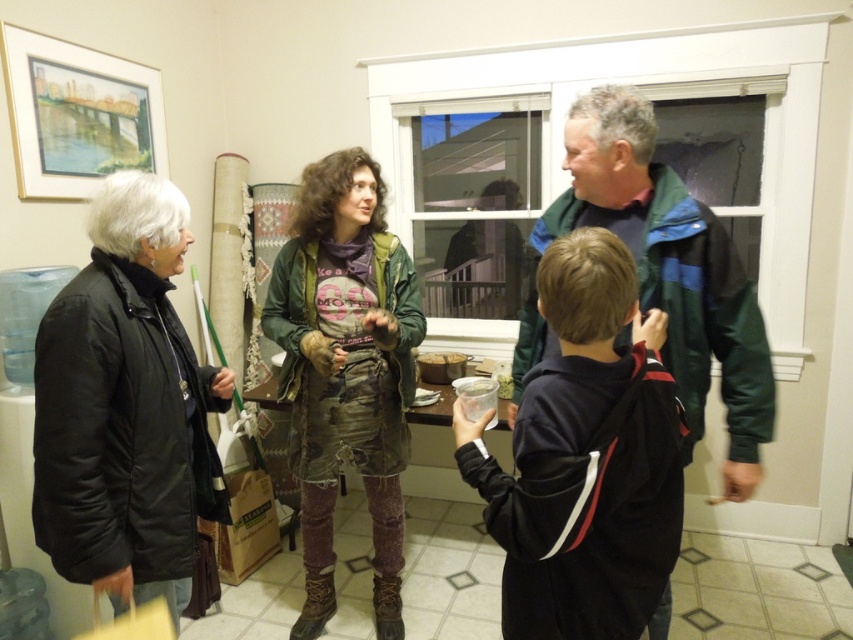
You are a photographer trying to capture a group photo of the dark blue fleece jacket at center and the rusty leather jacket at center. The camera you are using has a minimum focus distance of 36 inches. Will both jackets be in focus if you position the camera exactly in between them?

The dark blue fleece jacket at center and the rusty leather jacket at center are 36.89 inches apart. If the camera is placed exactly between them, each jacket will be 18.445 inches away from the camera. Since the minimum focus distance is 36 inches, which is greater than 18.445 inches, the jackets will not be in focus. The camera needs to be moved closer to ensure both are within the focus range.

You are trying to decide which jacket to borrow for a quick errand. The black puffy jacket at left is narrower than the green jacket at center. Which jacket would be easier to move through a narrow hallway?

The black puffy jacket at left has a lesser width compared to the green jacket at center, so it would be easier to move through a narrow hallway because it is narrower.

You are standing at the origin of the coordinate system in the room. There are two points marked in the room at coordinates point (538, 275) and point (370, 422). Which point is closer to you?

Point (538, 275) is in front of point (370, 422), so it is closer to you.